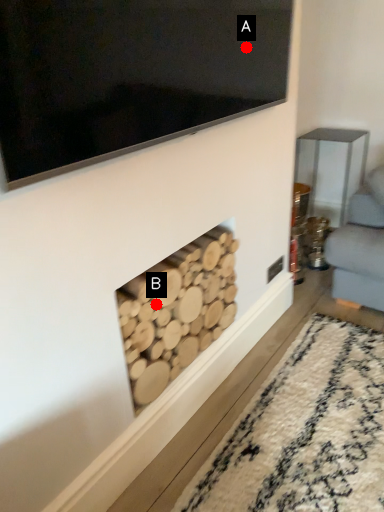
Question: Two points are circled on the image, labeled by A and B beside each circle. Which of the following is the farthest from the observer?

Choices:
 (A) A is further
 (B) B is further

Answer: (B)